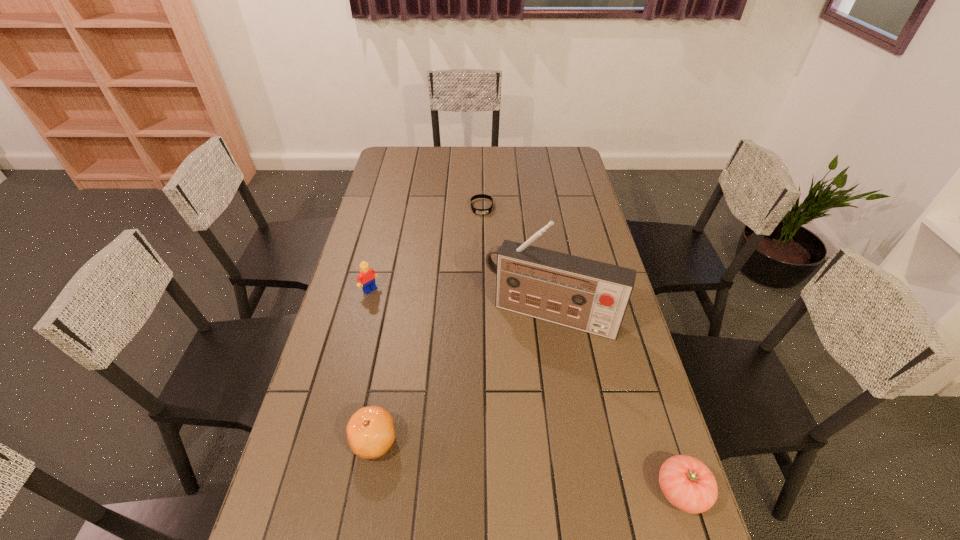
Identify the location of Lego that is at the left edge. The height and width of the screenshot is (540, 960). (366, 279).

You are a GUI agent. You are given a task and a screenshot of the screen. Output one action in this format:
    pyautogui.click(x=<x>, y=<y>)
    Task: Click on the tomato at the right edge
    The width and height of the screenshot is (960, 540).
    Given the screenshot: What is the action you would take?
    pyautogui.click(x=688, y=484)

Locate an element on the screen. radio receiver at the right edge is located at coordinates (592, 296).

Locate an element on the screen. This screenshot has width=960, height=540. object at the near right corner is located at coordinates (688, 484).

Image resolution: width=960 pixels, height=540 pixels. What are the coordinates of `vacant space at the far edge` in the screenshot? It's located at (431, 160).

Where is `vacant space at the left edge of the desktop`? vacant space at the left edge of the desktop is located at coordinates (396, 215).

In the image, there is a desktop. Where is `vacant area at the right edge`? vacant area at the right edge is located at coordinates (613, 450).

Where is `vacant space at the far left corner of the desktop`? vacant space at the far left corner of the desktop is located at coordinates (418, 158).

This screenshot has height=540, width=960. I want to click on vacant space at the far right corner of the desktop, so click(542, 154).

Image resolution: width=960 pixels, height=540 pixels. Identify the location of vacant area that lies between the tomato and the tallest object. (616, 403).